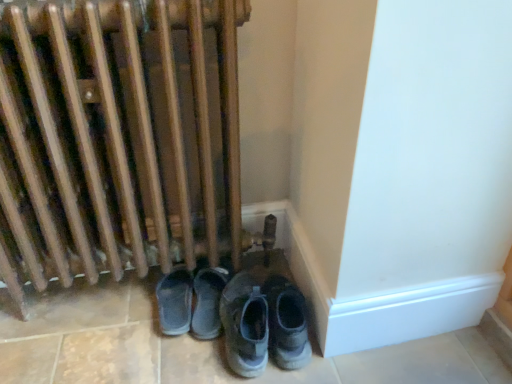
Locate an element on the screen. gray fabric sneakers at lower center, placed as the 3th footwear when sorted from left to right is located at coordinates (287, 323).

From the image's perspective, is gray suede shoes at lower center, positioned as the third footwear in right-to-left order, located beneath gray fabric sneakers at lower center, placed as the 3th footwear when sorted from left to right?

Correct, gray suede shoes at lower center, positioned as the third footwear in right-to-left order, appears lower than gray fabric sneakers at lower center, placed as the 3th footwear when sorted from left to right, in the image.

Is gray fabric sneakers at lower center, placed as the 3th footwear when sorted from left to right, surrounded by gray suede shoes at lower center, positioned as the third footwear in right-to-left order?

No, gray suede shoes at lower center, positioned as the third footwear in right-to-left order, does not contain gray fabric sneakers at lower center, placed as the 3th footwear when sorted from left to right.

Does point (169, 294) lie behind point (270, 310)?

Yes, point (169, 294) is behind point (270, 310).

Can you tell me how much gray fabric sneakers at lower center, which ranks as the 1th footwear in right-to-left order, and gray suede sneakers at lower center, which ranks as the second footwear in right-to-left order, differ in facing direction?

gray fabric sneakers at lower center, which ranks as the 1th footwear in right-to-left order, and gray suede sneakers at lower center, which ranks as the second footwear in right-to-left order, are facing 1.68 degrees away from each other.

Between gray fabric sneakers at lower center, placed as the 3th footwear when sorted from left to right, and gray suede sneakers at lower center, which ranks as the second footwear in right-to-left order, which one appears on the left side from the viewer's perspective?

gray suede sneakers at lower center, which ranks as the second footwear in right-to-left order.

Is gray fabric sneakers at lower center, placed as the 3th footwear when sorted from left to right, not near gray suede sneakers at lower center, the 2th footwear positioned from the left?

gray fabric sneakers at lower center, placed as the 3th footwear when sorted from left to right, is actually quite close to gray suede sneakers at lower center, the 2th footwear positioned from the left.

Who is taller, gray fabric sneakers at lower center, placed as the 3th footwear when sorted from left to right, or gray suede sneakers at lower center, the 2th footwear positioned from the left?

gray suede sneakers at lower center, the 2th footwear positioned from the left, is taller.

In the scene shown: Considering the sizes of objects gray suede shoes at lower center, marked as the first footwear in a left-to-right arrangement, and gray suede sneakers at lower center, the 2th footwear positioned from the left, in the image provided, who is thinner, gray suede shoes at lower center, marked as the first footwear in a left-to-right arrangement, or gray suede sneakers at lower center, the 2th footwear positioned from the left,?

gray suede shoes at lower center, marked as the first footwear in a left-to-right arrangement, is thinner.

Considering the relative positions of gray suede shoes at lower center, marked as the first footwear in a left-to-right arrangement, and gray suede sneakers at lower center, the 2th footwear positioned from the left, in the image provided, is gray suede shoes at lower center, marked as the first footwear in a left-to-right arrangement, to the left or to the right of gray suede sneakers at lower center, the 2th footwear positioned from the left,?

gray suede shoes at lower center, marked as the first footwear in a left-to-right arrangement, is to the left of gray suede sneakers at lower center, the 2th footwear positioned from the left.

Is point (165, 330) positioned behind point (250, 310)?

Yes, point (165, 330) is farther from viewer.

Can you tell me how much gray suede shoes at lower center, positioned as the third footwear in right-to-left order, and gray suede sneakers at lower center, the 2th footwear positioned from the left, differ in facing direction?

They differ by 0.00169 degrees in their facing directions.

Is gray suede sneakers at lower center, the 2th footwear positioned from the left, not inside gray fabric sneakers at lower center, placed as the 3th footwear when sorted from left to right?

Yes.

Which object is positioned more to the left, gray suede sneakers at lower center, which ranks as the second footwear in right-to-left order, or gray fabric sneakers at lower center, which ranks as the 1th footwear in right-to-left order?

Positioned to the left is gray suede sneakers at lower center, which ranks as the second footwear in right-to-left order.

Considering the relative sizes of gray suede sneakers at lower center, which ranks as the second footwear in right-to-left order, and gray fabric sneakers at lower center, placed as the 3th footwear when sorted from left to right, in the image provided, is gray suede sneakers at lower center, which ranks as the second footwear in right-to-left order, taller than gray fabric sneakers at lower center, placed as the 3th footwear when sorted from left to right,?

Yes, gray suede sneakers at lower center, which ranks as the second footwear in right-to-left order, is taller than gray fabric sneakers at lower center, placed as the 3th footwear when sorted from left to right.

Locate an element on the screen. The width and height of the screenshot is (512, 384). footwear that is the 2nd object above the gray suede shoes at lower center, marked as the first footwear in a left-to-right arrangement (from a real-world perspective) is located at coordinates (287, 323).

From a real-world perspective, is gray fabric sneakers at lower center, which ranks as the 1th footwear in right-to-left order, on gray suede shoes at lower center, marked as the first footwear in a left-to-right arrangement?

Yes.

Which of these two, gray fabric sneakers at lower center, which ranks as the 1th footwear in right-to-left order, or gray suede shoes at lower center, positioned as the third footwear in right-to-left order, stands taller?

gray fabric sneakers at lower center, which ranks as the 1th footwear in right-to-left order.

Considering the relative positions of gray fabric sneakers at lower center, placed as the 3th footwear when sorted from left to right, and gray suede shoes at lower center, marked as the first footwear in a left-to-right arrangement, in the image provided, is gray fabric sneakers at lower center, placed as the 3th footwear when sorted from left to right, to the left of gray suede shoes at lower center, marked as the first footwear in a left-to-right arrangement, from the viewer's perspective?

Incorrect, gray fabric sneakers at lower center, placed as the 3th footwear when sorted from left to right, is not on the left side of gray suede shoes at lower center, marked as the first footwear in a left-to-right arrangement.

Is gray suede sneakers at lower center, the 2th footwear positioned from the left, aimed at gray suede shoes at lower center, positioned as the third footwear in right-to-left order?

No, gray suede sneakers at lower center, the 2th footwear positioned from the left, is not turned towards gray suede shoes at lower center, positioned as the third footwear in right-to-left order.

Is gray suede sneakers at lower center, which ranks as the second footwear in right-to-left order, beside gray suede shoes at lower center, positioned as the third footwear in right-to-left order?

They are not placed beside each other.

Between gray suede sneakers at lower center, which ranks as the second footwear in right-to-left order, and gray suede shoes at lower center, marked as the first footwear in a left-to-right arrangement, which one is positioned in front?

gray suede sneakers at lower center, which ranks as the second footwear in right-to-left order.

How different are the orientations of gray suede sneakers at lower center, the 2th footwear positioned from the left, and gray suede shoes at lower center, positioned as the third footwear in right-to-left order, in degrees?

gray suede sneakers at lower center, the 2th footwear positioned from the left, and gray suede shoes at lower center, positioned as the third footwear in right-to-left order, are facing 0.00169 degrees away from each other.

Considering the sizes of objects gray suede sneakers at lower center, the 2th footwear positioned from the left, and wooden radiator at lower left in the image provided, who is smaller, gray suede sneakers at lower center, the 2th footwear positioned from the left, or wooden radiator at lower left?

Smaller between the two is gray suede sneakers at lower center, the 2th footwear positioned from the left.

Considering the sizes of objects gray suede sneakers at lower center, the 2th footwear positioned from the left, and wooden radiator at lower left in the image provided, who is wider, gray suede sneakers at lower center, the 2th footwear positioned from the left, or wooden radiator at lower left?

gray suede sneakers at lower center, the 2th footwear positioned from the left.

In the scene shown: Can wooden radiator at lower left be found inside gray suede sneakers at lower center, which ranks as the second footwear in right-to-left order?

That's incorrect, wooden radiator at lower left is not inside gray suede sneakers at lower center, which ranks as the second footwear in right-to-left order.

From a real-world perspective, who is located higher, gray suede sneakers at lower center, which ranks as the second footwear in right-to-left order, or wooden radiator at lower left?

wooden radiator at lower left.

In order to click on footwear that is the 2nd one when counting leftward from the gray fabric sneakers at lower center, which ranks as the 1th footwear in right-to-left order in this screenshot , I will do `click(175, 301)`.

Image resolution: width=512 pixels, height=384 pixels. I want to click on footwear that is the 1st one below the gray fabric sneakers at lower center, placed as the 3th footwear when sorted from left to right (from a real-world perspective), so click(x=245, y=325).

From the image, which object appears to be farther from wooden radiator at lower left, gray suede sneakers at lower center, which ranks as the second footwear in right-to-left order, or gray suede shoes at lower center, positioned as the third footwear in right-to-left order?

gray suede sneakers at lower center, which ranks as the second footwear in right-to-left order, is further to wooden radiator at lower left.

Looking at the image, which one is located closer to gray suede sneakers at lower center, which ranks as the second footwear in right-to-left order, wooden radiator at lower left or gray suede shoes at lower center, positioned as the third footwear in right-to-left order?

gray suede shoes at lower center, positioned as the third footwear in right-to-left order.

Which object lies further to the anchor point gray suede shoes at lower center, positioned as the third footwear in right-to-left order, gray fabric sneakers at lower center, which ranks as the 1th footwear in right-to-left order, or wooden radiator at lower left?

The object further to gray suede shoes at lower center, positioned as the third footwear in right-to-left order, is wooden radiator at lower left.

Looking at the image, which one is located closer to gray suede shoes at lower center, marked as the first footwear in a left-to-right arrangement, wooden radiator at lower left or gray fabric sneakers at lower center, which ranks as the 1th footwear in right-to-left order?

Based on the image, gray fabric sneakers at lower center, which ranks as the 1th footwear in right-to-left order, appears to be nearer to gray suede shoes at lower center, marked as the first footwear in a left-to-right arrangement.

Which object lies further to the anchor point gray suede shoes at lower center, marked as the first footwear in a left-to-right arrangement, wooden radiator at lower left or gray suede sneakers at lower center, the 2th footwear positioned from the left?

Among the two, wooden radiator at lower left is located further to gray suede shoes at lower center, marked as the first footwear in a left-to-right arrangement.

When comparing their distances from wooden radiator at lower left, does gray fabric sneakers at lower center, which ranks as the 1th footwear in right-to-left order, or gray suede sneakers at lower center, which ranks as the second footwear in right-to-left order, seem closer?

gray suede sneakers at lower center, which ranks as the second footwear in right-to-left order, lies closer to wooden radiator at lower left than the other object.

Based on their spatial positions, is gray suede sneakers at lower center, which ranks as the second footwear in right-to-left order, or gray fabric sneakers at lower center, placed as the 3th footwear when sorted from left to right, closer to wooden radiator at lower left?

Among the two, gray suede sneakers at lower center, which ranks as the second footwear in right-to-left order, is located nearer to wooden radiator at lower left.

From the image, which object appears to be farther from gray fabric sneakers at lower center, which ranks as the 1th footwear in right-to-left order, gray suede shoes at lower center, positioned as the third footwear in right-to-left order, or wooden radiator at lower left?

Based on the image, wooden radiator at lower left appears to be further to gray fabric sneakers at lower center, which ranks as the 1th footwear in right-to-left order.

The image size is (512, 384). What are the coordinates of `footwear situated between gray suede shoes at lower center, marked as the first footwear in a left-to-right arrangement, and gray fabric sneakers at lower center, placed as the 3th footwear when sorted from left to right, from left to right` in the screenshot? It's located at (245, 325).